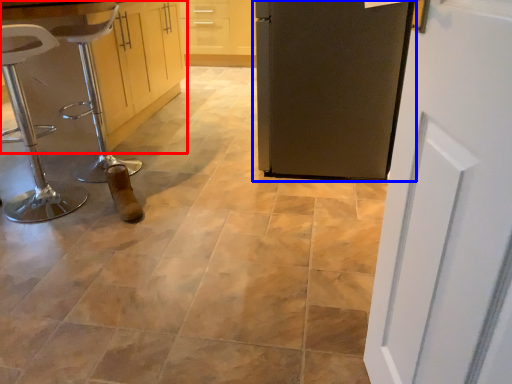
Question: Which object is further to the camera taking this photo, cabinetry (highlighted by a red box) or door (highlighted by a blue box)?

Choices:
 (A) cabinetry
 (B) door

Answer: (A)